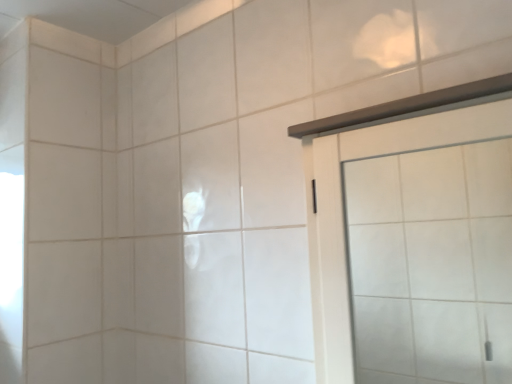
The image size is (512, 384). What do you see at coordinates (342, 211) in the screenshot?
I see `satin white door at upper right` at bounding box center [342, 211].

This screenshot has width=512, height=384. Identify the location of satin white door at upper right. (342, 211).

The width and height of the screenshot is (512, 384). I want to click on satin white door at upper right, so click(x=342, y=211).